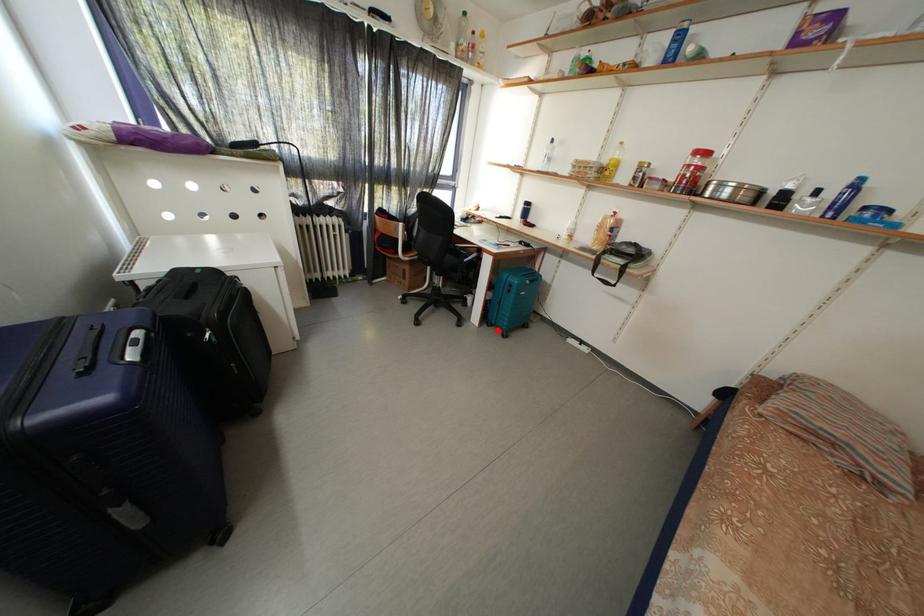
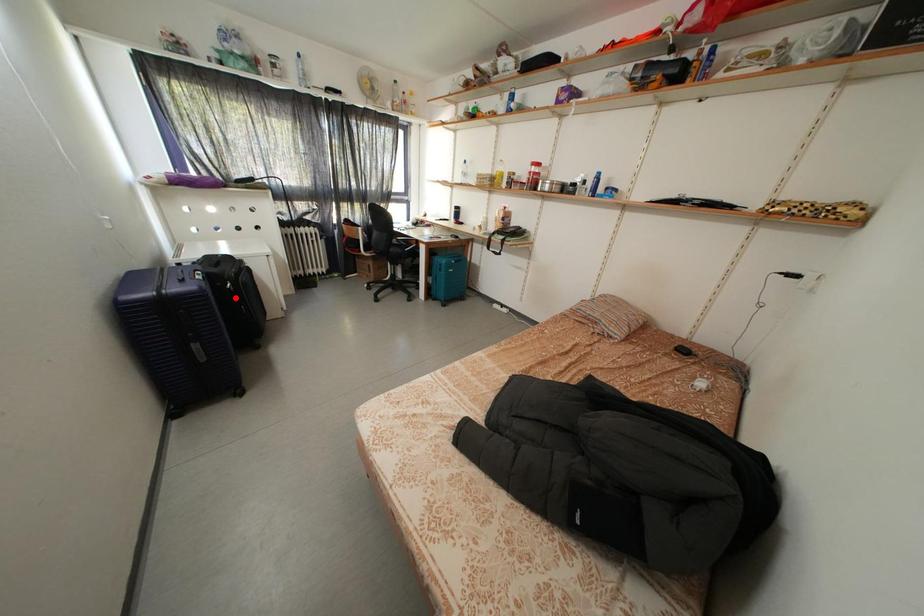
I am providing you with two images of the same scene from different viewpoints. A red point is marked on the first image and another point is marked on the second image. Do the highlighted points in image1 and image2 indicate the same real-world spot?

No